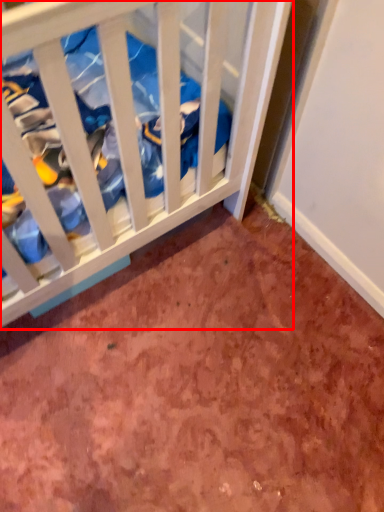
Question: Considering the relative positions of infant bed (annotated by the red box) and dirt in the image provided, where is infant bed (annotated by the red box) located with respect to the staircase?

Choices:
 (A) left
 (B) right

Answer: (A)